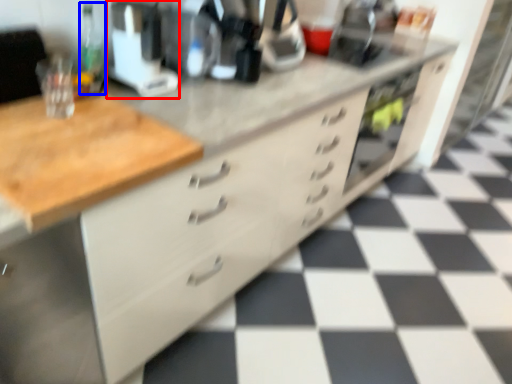
Question: Which point is further to the camera, appliance (highlighted by a red box) or bottle (highlighted by a blue box)?

Choices:
 (A) appliance
 (B) bottle

Answer: (B)